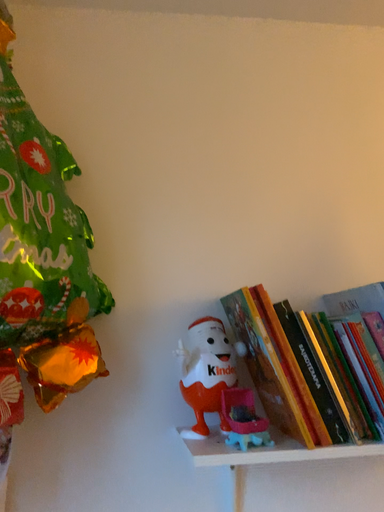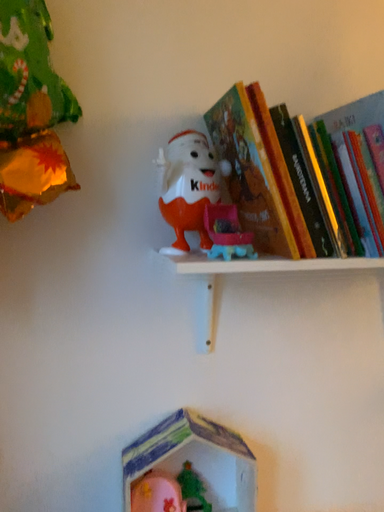
Question: How did the camera likely rotate when shooting the video?

Choices:
 (A) rotated upward
 (B) rotated downward

Answer: (B)